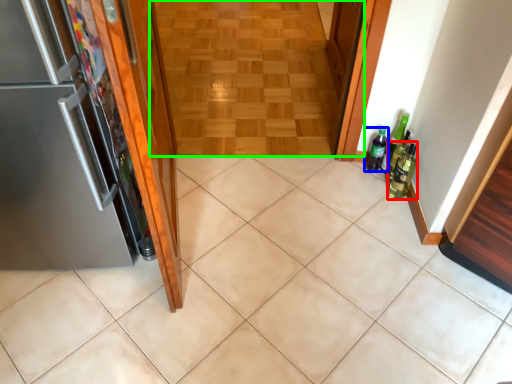
Question: Which object is positioned closest to beer bottle (highlighted by a red box)? Select from bottle (highlighted by a blue box) and corridor (highlighted by a green box).

Choices:
 (A) bottle
 (B) corridor

Answer: (A)